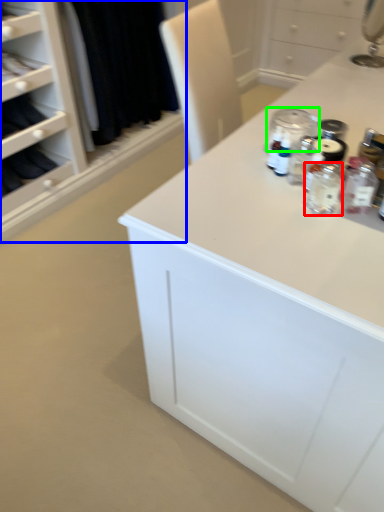
Question: Which is farther away from bottle (highlighted by a red box)? closet (highlighted by a blue box) or glass jar (highlighted by a green box)?

Choices:
 (A) closet
 (B) glass jar

Answer: (A)